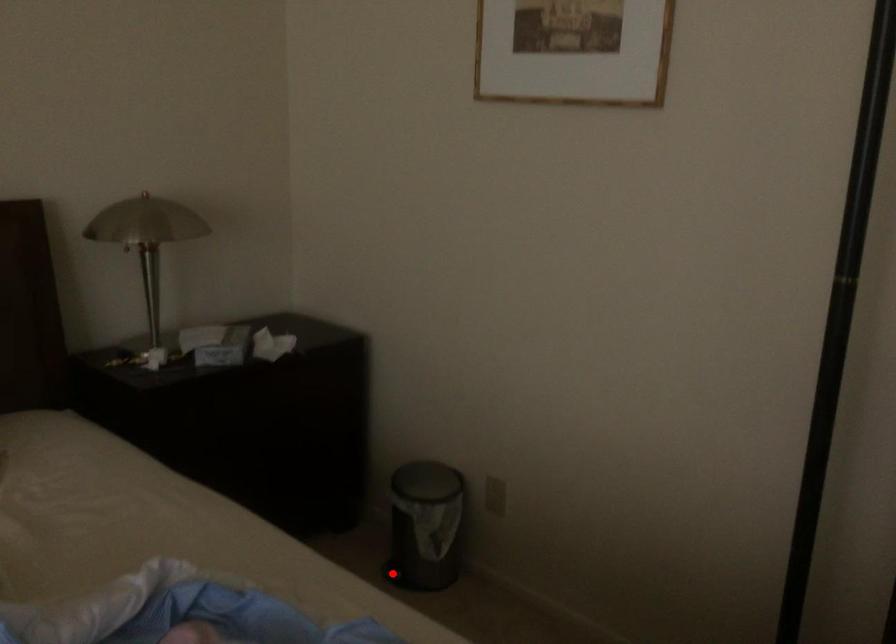
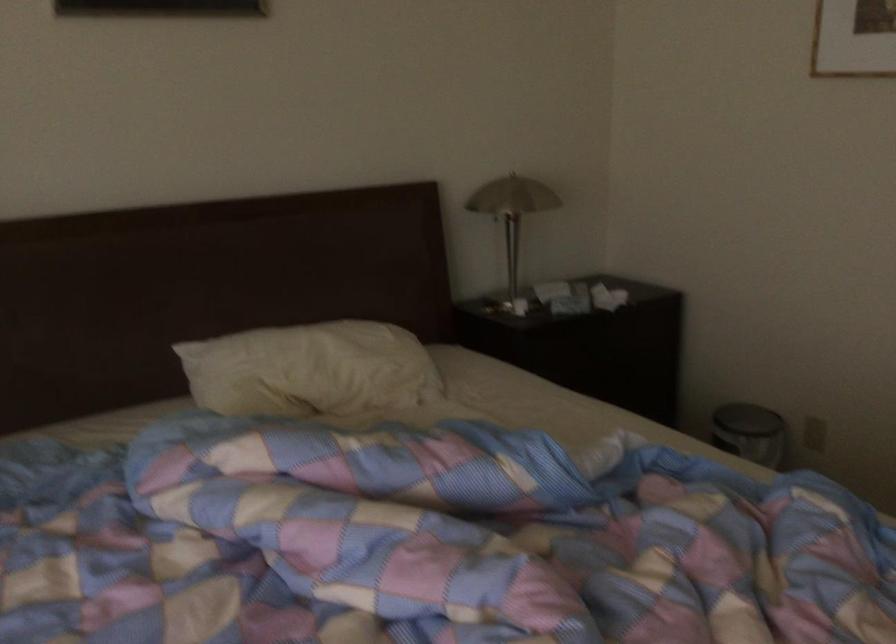
Question: I am providing you with two images of the same scene from different viewpoints. A red point is marked on the first image. Is the red point's position out of view in image 2?

Choices:
 (A) Yes
 (B) No

Answer: (A)